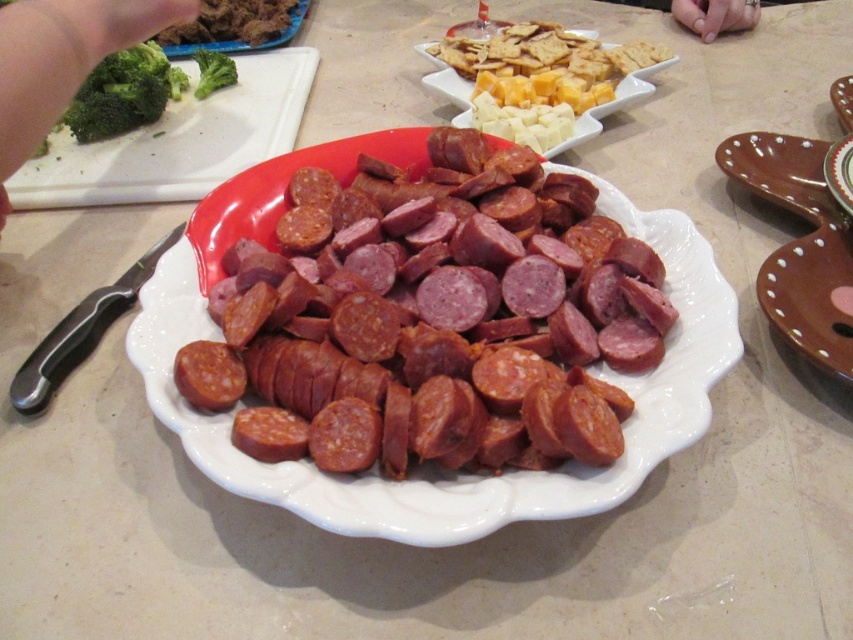
Between matte white plate at upper left and green broccoli at upper left, which one is positioned higher?

matte white plate at upper left

Does matte white plate at upper left have a greater height compared to green broccoli at upper left?

Indeed, matte white plate at upper left has a greater height compared to green broccoli at upper left.

Which is behind, point (134, 182) or point (9, 74)?

The point (134, 182) is more distant.

What are the coordinates of `matte white plate at upper left` in the screenshot? It's located at (178, 140).

Does white glossy plate at center appear over green leafy broccoli at upper left?

No.

Can you confirm if white glossy plate at center is positioned below green leafy broccoli at upper left?

Yes, white glossy plate at center is below green leafy broccoli at upper left.

This screenshot has height=640, width=853. What do you see at coordinates (430, 468) in the screenshot? I see `white glossy plate at center` at bounding box center [430, 468].

Identify the location of white glossy plate at center. The height and width of the screenshot is (640, 853). (430, 468).

Who is taller, matte white plate at upper left or green fresh broccoli at upper left?

matte white plate at upper left is taller.

Which of these two, matte white plate at upper left or green fresh broccoli at upper left, stands shorter?

Standing shorter between the two is green fresh broccoli at upper left.

I want to click on matte white plate at upper left, so point(178,140).